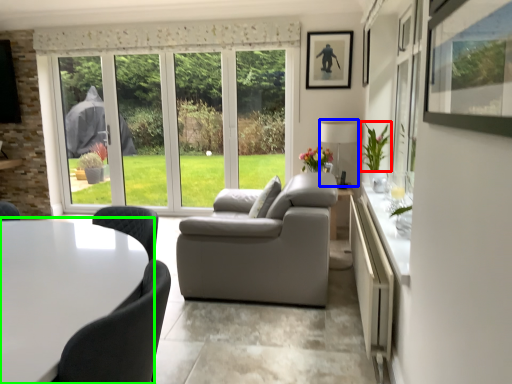
Question: Which is nearer to the plant (highlighted by a red box)? lamp (highlighted by a blue box) or table (highlighted by a green box).

Choices:
 (A) lamp
 (B) table

Answer: (A)